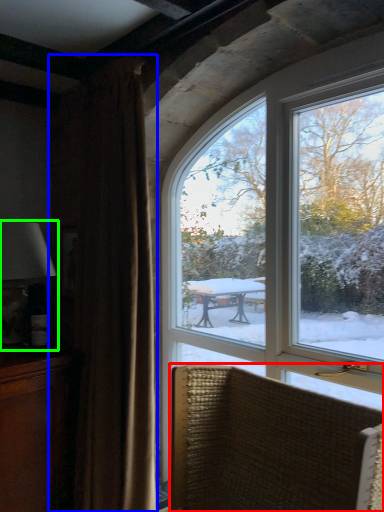
Question: Based on their relative distances, which object is nearer to chair (highlighted by a red box)? Choose from curtain (highlighted by a blue box) and table lamp (highlighted by a green box).

Choices:
 (A) curtain
 (B) table lamp

Answer: (A)